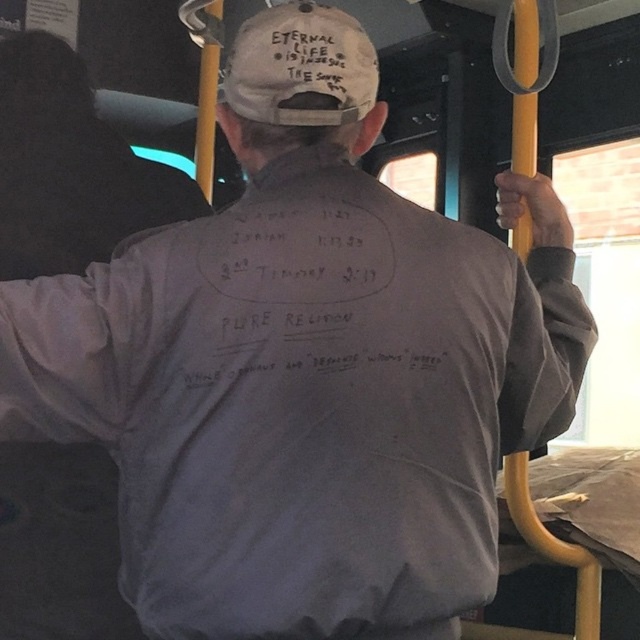
You are a photographer trying to capture the text on both the gray cotton sweatshirt at upper left and the white fabric cap at upper center. Since you can only focus on one object at a time, which one should you adjust your camera lens to focus on first to ensure the text is legible?

The gray cotton sweatshirt at upper left has a greater height compared to the white fabric cap at upper center, so focusing on the gray cotton sweatshirt at upper left first would allow you to capture the text more clearly due to its larger size.

You are a tailor measuring clothing items in the image. You need to determine if the distance between the gray cotton sweatshirt at upper left and the white fabric cap at upper center is sufficient to sew a 12 inch long ribbon between them. Can you confirm if the distance allows for this?

The gray cotton sweatshirt at upper left is 12.06 inches from the white fabric cap at upper center, which is just enough to sew a 12 inch long ribbon between them since the distance is slightly longer than required.